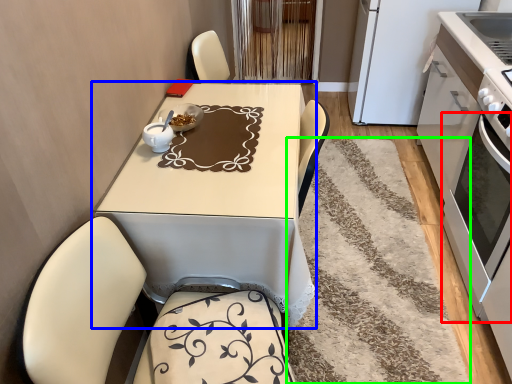
Question: Considering the real-world distances, which object is closest to oven (highlighted by a red box)? table (highlighted by a blue box) or mat (highlighted by a green box).

Choices:
 (A) table
 (B) mat

Answer: (B)